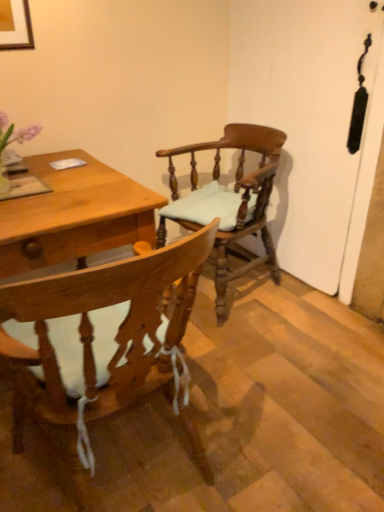
Based on the photo, measure the distance between point (264, 203) and camera.

Point (264, 203) and camera are 2.12 meters apart.

This screenshot has height=512, width=384. Identify the location of wooden chair with cushion at center, placed as the second chair when sorted from front to back. (238, 198).

Describe the element at coordinates (238, 198) in the screenshot. The height and width of the screenshot is (512, 384). I see `wooden chair with cushion at center, which is counted as the 1th chair, starting from the back` at that location.

Find the location of a particular element. wooden chair with white cushion at center, the 2th chair viewed from the back is located at coordinates (104, 343).

What do you see at coordinates (104, 343) in the screenshot?
I see `wooden chair with white cushion at center, placed as the first chair when sorted from front to back` at bounding box center [104, 343].

This screenshot has height=512, width=384. Find the location of `wooden chair with cushion at center, placed as the second chair when sorted from front to back`. wooden chair with cushion at center, placed as the second chair when sorted from front to back is located at coordinates (238, 198).

Considering the relative positions of wooden chair with cushion at center, which is counted as the 1th chair, starting from the back, and wooden chair with white cushion at center, placed as the first chair when sorted from front to back, in the image provided, is wooden chair with cushion at center, which is counted as the 1th chair, starting from the back, to the left or to the right of wooden chair with white cushion at center, placed as the first chair when sorted from front to back,?

Clearly, wooden chair with cushion at center, which is counted as the 1th chair, starting from the back, is on the right of wooden chair with white cushion at center, placed as the first chair when sorted from front to back, in the image.

Considering the relative positions of wooden chair with cushion at center, placed as the second chair when sorted from front to back, and wooden chair with white cushion at center, the 2th chair viewed from the back, in the image provided, is wooden chair with cushion at center, placed as the second chair when sorted from front to back, in front of wooden chair with white cushion at center, the 2th chair viewed from the back,?

No, wooden chair with cushion at center, placed as the second chair when sorted from front to back, is further to the viewer.

Between point (178, 215) and point (72, 349), which one is positioned in front?

The point (72, 349) is closer to the camera.

From the image's perspective, is wooden chair with cushion at center, placed as the second chair when sorted from front to back, located above or below wooden chair with white cushion at center, the 2th chair viewed from the back?

Based on their image positions, wooden chair with cushion at center, placed as the second chair when sorted from front to back, is located above wooden chair with white cushion at center, the 2th chair viewed from the back.

From a real-world perspective, who is located higher, wooden chair with cushion at center, which is counted as the 1th chair, starting from the back, or wooden chair with white cushion at center, placed as the first chair when sorted from front to back?

In real-world perspective, wooden chair with white cushion at center, placed as the first chair when sorted from front to back, is above.

Considering the relative sizes of wooden chair with cushion at center, placed as the second chair when sorted from front to back, and wooden chair with white cushion at center, the 2th chair viewed from the back, in the image provided, is wooden chair with cushion at center, placed as the second chair when sorted from front to back, thinner than wooden chair with white cushion at center, the 2th chair viewed from the back,?

Yes, wooden chair with cushion at center, placed as the second chair when sorted from front to back, is thinner than wooden chair with white cushion at center, the 2th chair viewed from the back.

Considering the sizes of objects wooden chair with cushion at center, which is counted as the 1th chair, starting from the back, and wooden chair with white cushion at center, the 2th chair viewed from the back, in the image provided, who is taller, wooden chair with cushion at center, which is counted as the 1th chair, starting from the back, or wooden chair with white cushion at center, the 2th chair viewed from the back,?

wooden chair with white cushion at center, the 2th chair viewed from the back, is taller.

Consider the image. Considering the relative sizes of wooden chair with cushion at center, placed as the second chair when sorted from front to back, and wooden chair with white cushion at center, placed as the first chair when sorted from front to back, in the image provided, is wooden chair with cushion at center, placed as the second chair when sorted from front to back, smaller than wooden chair with white cushion at center, placed as the first chair when sorted from front to back,?

No, wooden chair with cushion at center, placed as the second chair when sorted from front to back, is not smaller than wooden chair with white cushion at center, placed as the first chair when sorted from front to back.

In the scene shown: Would you say wooden chair with cushion at center, which is counted as the 1th chair, starting from the back, is outside wooden chair with white cushion at center, the 2th chair viewed from the back?

Yes, wooden chair with cushion at center, which is counted as the 1th chair, starting from the back, is not within wooden chair with white cushion at center, the 2th chair viewed from the back.

Are wooden chair with cushion at center, which is counted as the 1th chair, starting from the back, and wooden chair with white cushion at center, placed as the first chair when sorted from front to back, located far from each other?

No, there isn't a large distance between wooden chair with cushion at center, which is counted as the 1th chair, starting from the back, and wooden chair with white cushion at center, placed as the first chair when sorted from front to back.

Is wooden chair with cushion at center, placed as the second chair when sorted from front to back, facing away from wooden chair with white cushion at center, the 2th chair viewed from the back?

wooden chair with cushion at center, placed as the second chair when sorted from front to back, does not have its back to wooden chair with white cushion at center, the 2th chair viewed from the back.

Can you tell me how much wooden chair with cushion at center, placed as the second chair when sorted from front to back, and wooden chair with white cushion at center, the 2th chair viewed from the back, differ in facing direction?

The angle between the facing direction of wooden chair with cushion at center, placed as the second chair when sorted from front to back, and the facing direction of wooden chair with white cushion at center, the 2th chair viewed from the back, is 95.7 degrees.

Locate an element on the screen. This screenshot has height=512, width=384. chair in front of the wooden chair with cushion at center, which is counted as the 1th chair, starting from the back is located at coordinates [x=104, y=343].

Would you say wooden chair with white cushion at center, placed as the first chair when sorted from front to back, is to the left or to the right of wooden chair with cushion at center, which is counted as the 1th chair, starting from the back, in the picture?

Clearly, wooden chair with white cushion at center, placed as the first chair when sorted from front to back, is on the left of wooden chair with cushion at center, which is counted as the 1th chair, starting from the back, in the image.

Which object is closer to the camera taking this photo, wooden chair with white cushion at center, placed as the first chair when sorted from front to back, or wooden chair with cushion at center, placed as the second chair when sorted from front to back?

Positioned in front is wooden chair with white cushion at center, placed as the first chair when sorted from front to back.

Does point (36, 290) appear closer or farther from the camera than point (171, 215)?

Point (36, 290) appears to be closer to the viewer than point (171, 215).

From the image's perspective, is wooden chair with white cushion at center, the 2th chair viewed from the back, positioned above or below wooden chair with cushion at center, placed as the second chair when sorted from front to back?

Based on their image positions, wooden chair with white cushion at center, the 2th chair viewed from the back, is located beneath wooden chair with cushion at center, placed as the second chair when sorted from front to back.

From a real-world perspective, who is located higher, wooden chair with white cushion at center, placed as the first chair when sorted from front to back, or wooden chair with cushion at center, which is counted as the 1th chair, starting from the back?

In real-world perspective, wooden chair with white cushion at center, placed as the first chair when sorted from front to back, is above.

Based on the photo, is wooden chair with white cushion at center, the 2th chair viewed from the back, wider than wooden chair with cushion at center, which is counted as the 1th chair, starting from the back?

Indeed, wooden chair with white cushion at center, the 2th chair viewed from the back, has a greater width compared to wooden chair with cushion at center, which is counted as the 1th chair, starting from the back.

From their relative heights in the image, would you say wooden chair with white cushion at center, placed as the first chair when sorted from front to back, is taller or shorter than wooden chair with cushion at center, placed as the second chair when sorted from front to back?

Clearly, wooden chair with white cushion at center, placed as the first chair when sorted from front to back, is taller compared to wooden chair with cushion at center, placed as the second chair when sorted from front to back.

Looking at the image, does wooden chair with white cushion at center, placed as the first chair when sorted from front to back, seem bigger or smaller compared to wooden chair with cushion at center, which is counted as the 1th chair, starting from the back?

wooden chair with white cushion at center, placed as the first chair when sorted from front to back, is smaller than wooden chair with cushion at center, which is counted as the 1th chair, starting from the back.

Is wooden chair with white cushion at center, placed as the first chair when sorted from front to back, outside of wooden chair with cushion at center, which is counted as the 1th chair, starting from the back?

Absolutely, wooden chair with white cushion at center, placed as the first chair when sorted from front to back, is external to wooden chair with cushion at center, which is counted as the 1th chair, starting from the back.

Is wooden chair with white cushion at center, placed as the first chair when sorted from front to back, placed right next to wooden chair with cushion at center, placed as the second chair when sorted from front to back?

No, wooden chair with white cushion at center, placed as the first chair when sorted from front to back, is not making contact with wooden chair with cushion at center, placed as the second chair when sorted from front to back.

Based on the photo, could you tell me if wooden chair with white cushion at center, placed as the first chair when sorted from front to back, is turned towards wooden chair with cushion at center, which is counted as the 1th chair, starting from the back?

No, wooden chair with white cushion at center, placed as the first chair when sorted from front to back, does not turn towards wooden chair with cushion at center, which is counted as the 1th chair, starting from the back.

Can you tell me how much wooden chair with white cushion at center, the 2th chair viewed from the back, and wooden chair with cushion at center, which is counted as the 1th chair, starting from the back, differ in facing direction?

The angle between the facing direction of wooden chair with white cushion at center, the 2th chair viewed from the back, and the facing direction of wooden chair with cushion at center, which is counted as the 1th chair, starting from the back, is 95.7 degrees.

Find the location of a particular element. Image resolution: width=384 pixels, height=512 pixels. chair above the wooden chair with white cushion at center, the 2th chair viewed from the back (from the image's perspective) is located at coordinates (238, 198).

Locate an element on the screen. chair below the wooden chair with white cushion at center, placed as the first chair when sorted from front to back (from a real-world perspective) is located at coordinates (238, 198).

Where is `chair above the wooden chair with white cushion at center, placed as the first chair when sorted from front to back (from the image's perspective)`? The width and height of the screenshot is (384, 512). chair above the wooden chair with white cushion at center, placed as the first chair when sorted from front to back (from the image's perspective) is located at coordinates (238, 198).